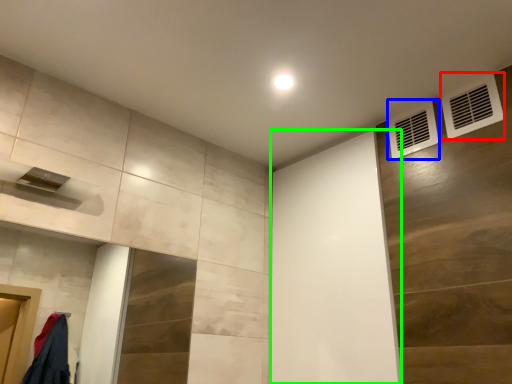
Question: Which object is the farthest from air conditioning (highlighted by a red box)? Choose among these: air conditioning (highlighted by a blue box) or screen door (highlighted by a green box).

Choices:
 (A) air conditioning
 (B) screen door

Answer: (B)